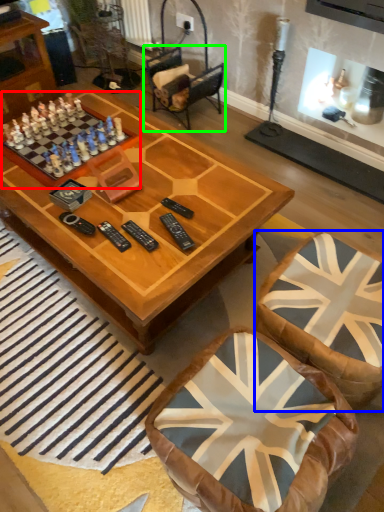
Question: Considering the real-world distances, which object is farthest from board game (highlighted by a red box)? swivel chair (highlighted by a blue box) or armchair (highlighted by a green box)?

Choices:
 (A) swivel chair
 (B) armchair

Answer: (A)